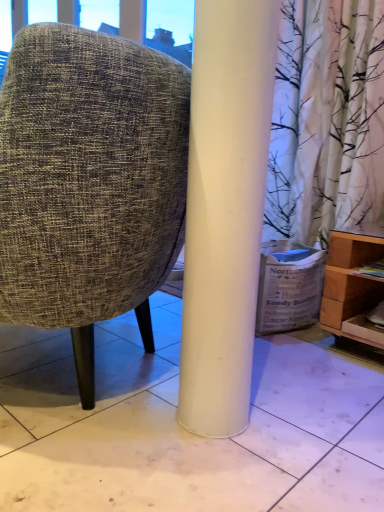
Question: Is white glossy tile at center positioned before white cardboard box at lower right?

Choices:
 (A) no
 (B) yes

Answer: (B)

Question: Is white glossy tile at center not within white cardboard box at lower right?

Choices:
 (A) yes
 (B) no

Answer: (A)

Question: From the image's perspective, is white glossy tile at center located above white cardboard box at lower right?

Choices:
 (A) yes
 (B) no

Answer: (B)

Question: Can you confirm if white glossy tile at center is positioned to the right of white cardboard box at lower right?

Choices:
 (A) yes
 (B) no

Answer: (B)

Question: Could you tell me if white glossy tile at center is turned towards white cardboard box at lower right?

Choices:
 (A) yes
 (B) no

Answer: (B)

Question: Does white glossy tile at center have a lesser height compared to white cardboard box at lower right?

Choices:
 (A) no
 (B) yes

Answer: (B)

Question: From a real-world perspective, does textured fabric chair at center sit lower than white cardboard box at lower right?

Choices:
 (A) yes
 (B) no

Answer: (B)

Question: Is textured fabric chair at center facing towards white cardboard box at lower right?

Choices:
 (A) no
 (B) yes

Answer: (A)

Question: Considering the relative sizes of textured fabric chair at center and white cardboard box at lower right in the image provided, is textured fabric chair at center thinner than white cardboard box at lower right?

Choices:
 (A) no
 (B) yes

Answer: (A)

Question: Are textured fabric chair at center and white cardboard box at lower right located far from each other?

Choices:
 (A) no
 (B) yes

Answer: (A)

Question: Is textured fabric chair at center positioned behind white cardboard box at lower right?

Choices:
 (A) no
 (B) yes

Answer: (A)

Question: Does textured fabric chair at center appear on the left side of white cardboard box at lower right?

Choices:
 (A) no
 (B) yes

Answer: (B)

Question: From the image's perspective, is white glossy tile at center beneath light brown wooden shelf at lower right?

Choices:
 (A) yes
 (B) no

Answer: (A)